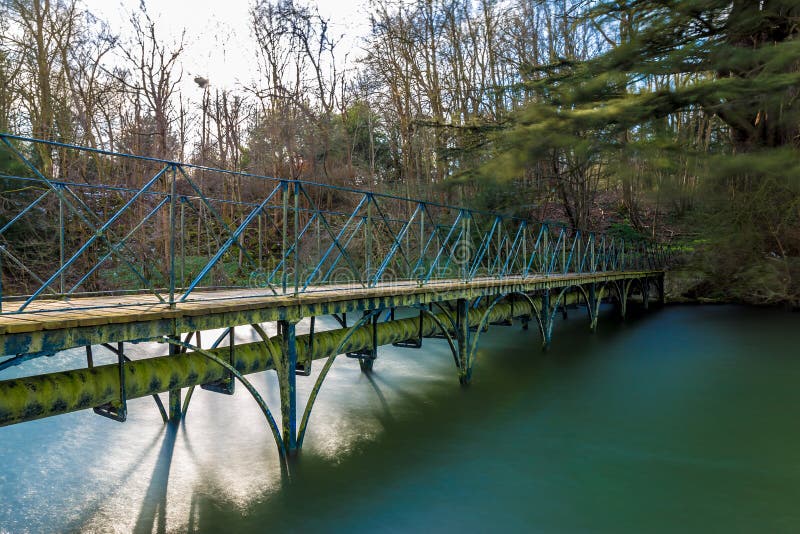
The width and height of the screenshot is (800, 534). What are the coordinates of `metal piping` in the screenshot? It's located at (256, 395).